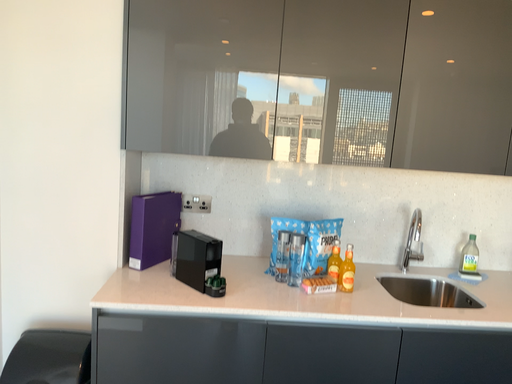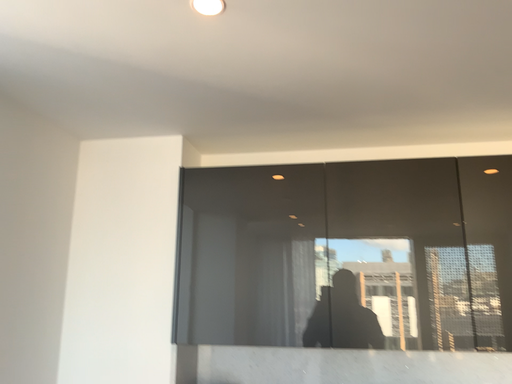
Question: Which way did the camera rotate in the video?

Choices:
 (A) rotated left
 (B) rotated right

Answer: (A)